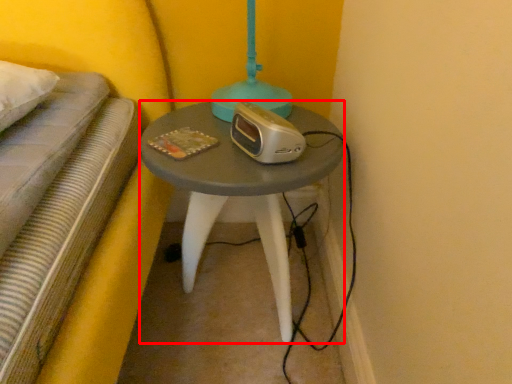
Question: From the image's perspective, where is table (annotated by the red box) located relative to appliance?

Choices:
 (A) below
 (B) above

Answer: (A)